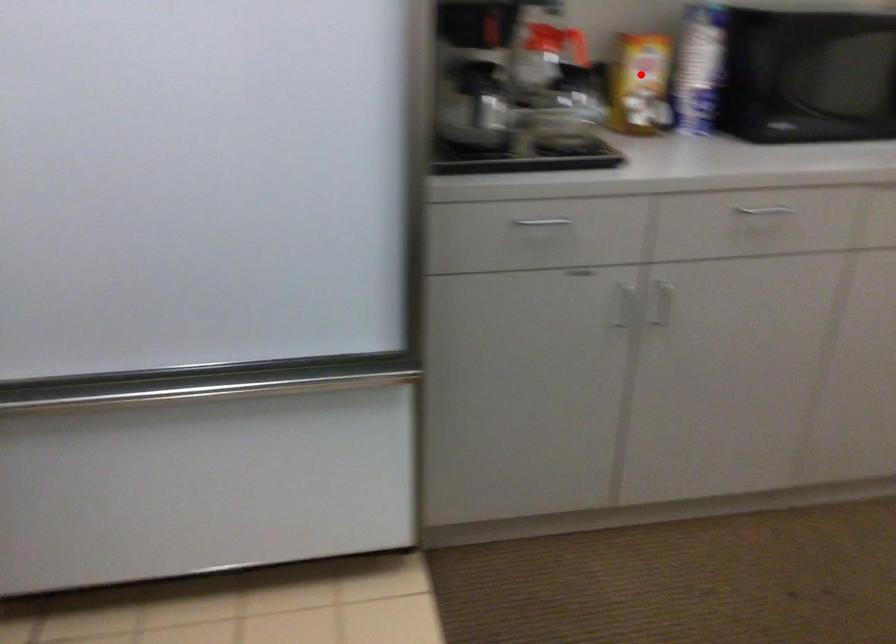
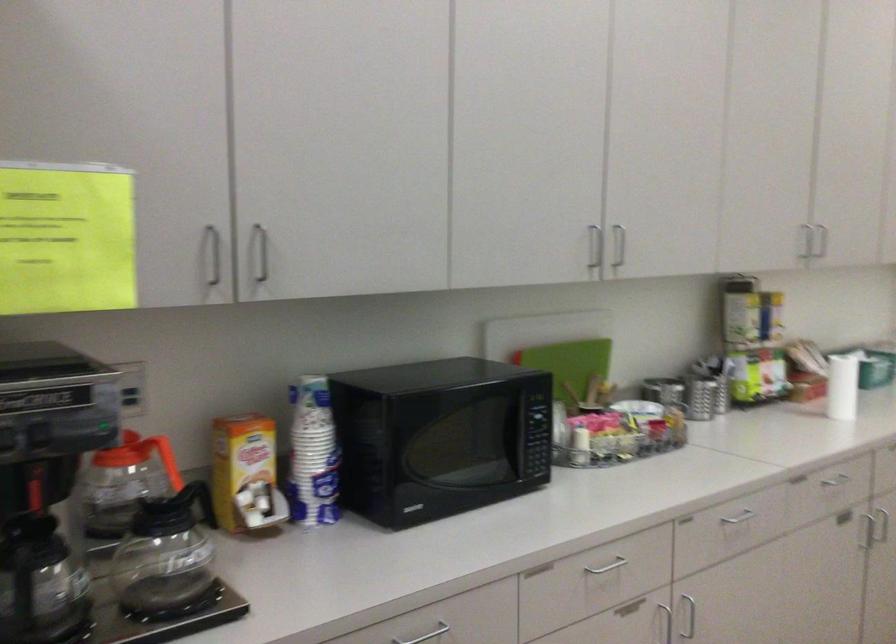
Locate, in the second image, the point that corresponds to the highlighted location in the first image.

(244, 471)